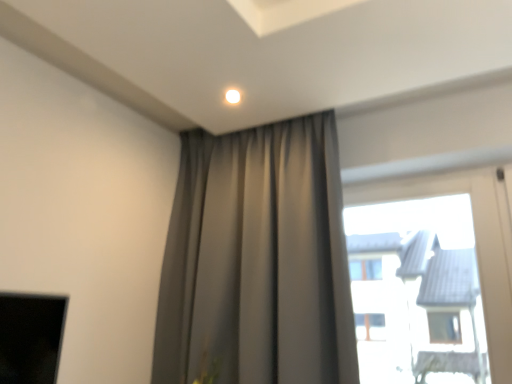
Question: Would you say satin gray curtain at upper center is outside transparent glass window at upper right?

Choices:
 (A) no
 (B) yes

Answer: (B)

Question: Would you say satin gray curtain at upper center contains transparent glass window at upper right?

Choices:
 (A) yes
 (B) no

Answer: (B)

Question: From the image's perspective, is satin gray curtain at upper center above transparent glass window at upper right?

Choices:
 (A) yes
 (B) no

Answer: (A)

Question: Is satin gray curtain at upper center at the left side of transparent glass window at upper right?

Choices:
 (A) yes
 (B) no

Answer: (A)

Question: Considering the relative sizes of satin gray curtain at upper center and transparent glass window at upper right in the image provided, is satin gray curtain at upper center shorter than transparent glass window at upper right?

Choices:
 (A) yes
 (B) no

Answer: (B)

Question: Is satin gray curtain at upper center placed right next to transparent glass window at upper right?

Choices:
 (A) yes
 (B) no

Answer: (B)

Question: Is transparent glass window at upper right positioned in front of satin gray curtain at upper center?

Choices:
 (A) yes
 (B) no

Answer: (B)

Question: Considering the relative sizes of transparent glass window at upper right and satin gray curtain at upper center in the image provided, is transparent glass window at upper right smaller than satin gray curtain at upper center?

Choices:
 (A) yes
 (B) no

Answer: (A)

Question: From a real-world perspective, is transparent glass window at upper right under satin gray curtain at upper center?

Choices:
 (A) no
 (B) yes

Answer: (B)

Question: Is satin gray curtain at upper center surrounded by transparent glass window at upper right?

Choices:
 (A) yes
 (B) no

Answer: (B)

Question: Can you confirm if transparent glass window at upper right is bigger than satin gray curtain at upper center?

Choices:
 (A) yes
 (B) no

Answer: (B)

Question: Can you confirm if transparent glass window at upper right is wider than satin gray curtain at upper center?

Choices:
 (A) no
 (B) yes

Answer: (A)

Question: From a real-world perspective, is satin gray curtain at upper center positioned above or below transparent glass window at upper right?

Choices:
 (A) below
 (B) above

Answer: (B)